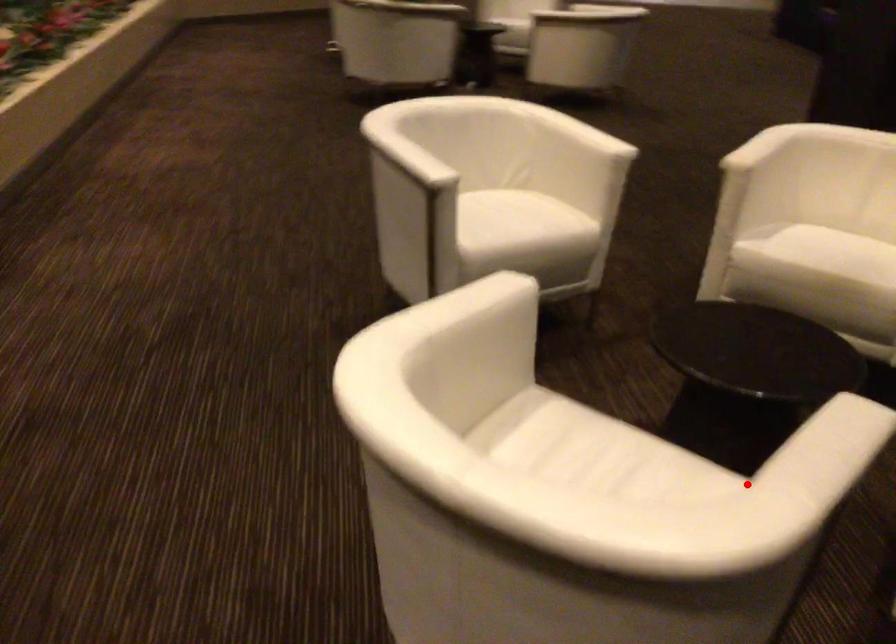
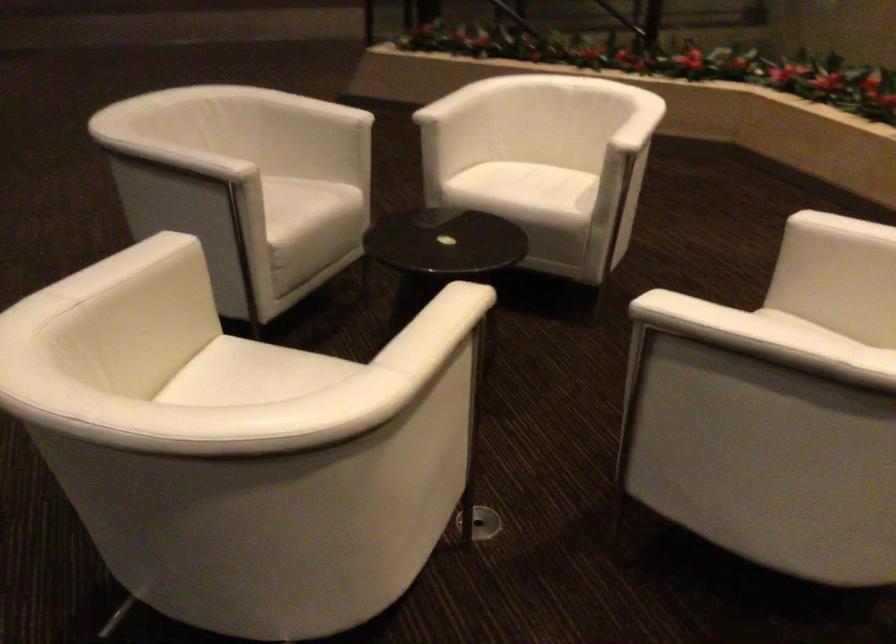
Question: I am providing you with two images of the same scene from different viewpoints. Given a red point in image1, look at the same physical point in image2. Is it:

Choices:
 (A) Closer to the viewpoint
 (B) Farther from the viewpoint

Answer: (B)